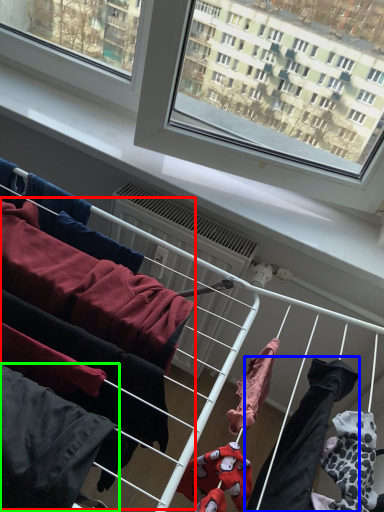
Question: Considering the real-world distances, which object is farthest from clothing (highlighted by a red box)? clothing (highlighted by a blue box) or clothing (highlighted by a green box)?

Choices:
 (A) clothing
 (B) clothing

Answer: (A)